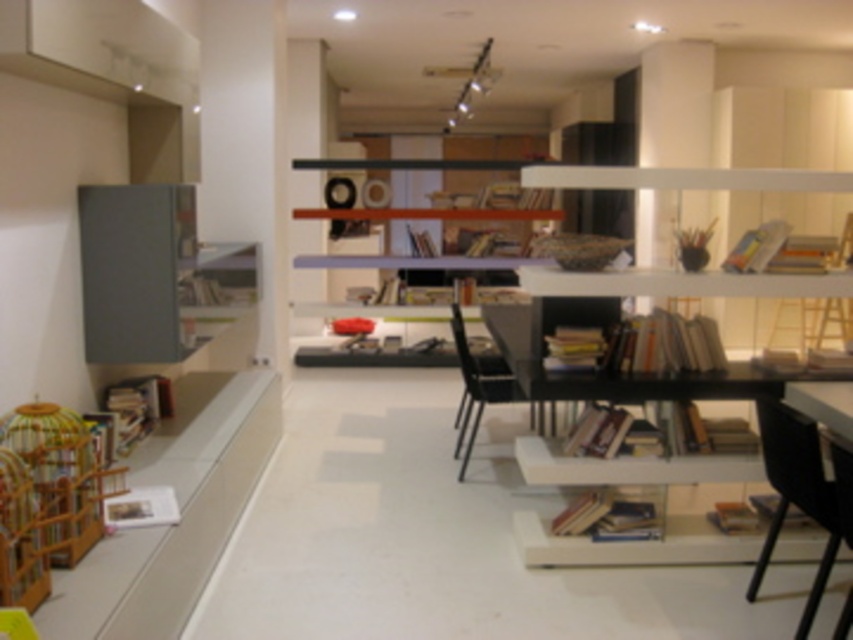
You are moving a large painting that is 1.2 meters wide. You want to place it on either the white matte bookshelf at upper right or the matte gray cabinet at left. Which surface can accommodate the painting without it overhanging the edge?

The matte gray cabinet at left can accommodate the painting since it is larger than the white matte bookshelf at upper right, which may not have enough space for the 1.2 meter wide painting.

You are planning to place a new lamp on the matte white bookshelf at center. However, you need to ensure there is enough space between the black plastic chair at lower right and the bookshelf to move around comfortably. Considering their sizes, which object takes up more space in the room?

The matte white bookshelf at center takes up more space in the room compared to the black plastic chair at lower right since the chair has a smaller size.

You are standing in the living room and see a point marked at coordinates (680, 284). Based on the scene description, can you determine which object this point is located on?

The point is located on the white matte bookshelf at upper right.